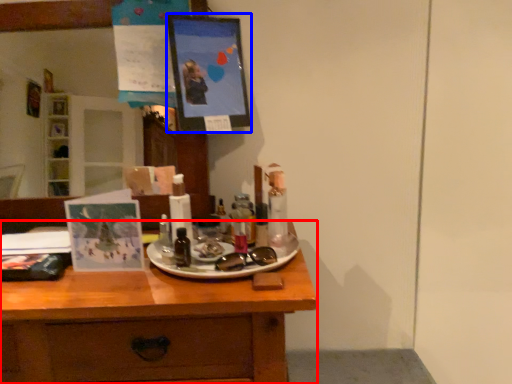
Question: Which point is further to the camera, desk (highlighted by a red box) or picture frame (highlighted by a blue box)?

Choices:
 (A) desk
 (B) picture frame

Answer: (B)